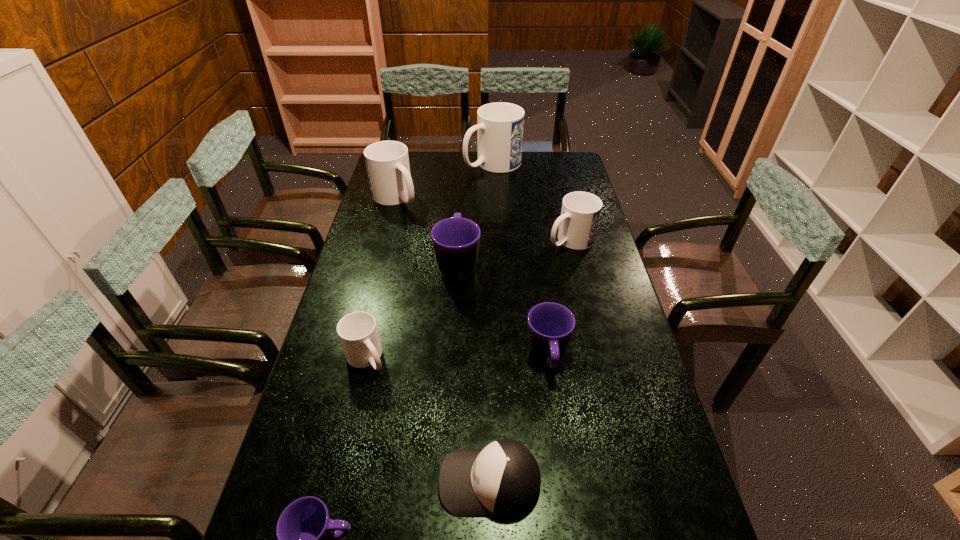
Where is `the smallest blue mug`? The width and height of the screenshot is (960, 540). the smallest blue mug is located at coordinates (357, 331).

Image resolution: width=960 pixels, height=540 pixels. I want to click on cap, so click(503, 480).

This screenshot has width=960, height=540. I want to click on blank space located on the right of the tallest object, so click(x=566, y=164).

Find the location of a particular element. vacant area located on the front of the second farthest object is located at coordinates (378, 264).

The image size is (960, 540). What are the coordinates of `free space located with the handle on the side of the farthest black mug` in the screenshot? It's located at (461, 213).

This screenshot has width=960, height=540. In order to click on free spot located with the handle on the side of the farthest black mug in this screenshot , I will do click(459, 236).

You are a GUI agent. You are given a task and a screenshot of the screen. Output one action in this format:
    pyautogui.click(x=<x>, y=<y>)
    Task: Click on the free region located 0.150m with the handle on the side of the farthest black mug
    The height and width of the screenshot is (540, 960).
    Given the screenshot: What is the action you would take?
    pyautogui.click(x=460, y=220)

Find the location of `free spot located on the left of the third farthest blue mug`. free spot located on the left of the third farthest blue mug is located at coordinates (498, 240).

You are a GUI agent. You are given a task and a screenshot of the screen. Output one action in this format:
    pyautogui.click(x=<x>, y=<y>)
    Task: Click on the vacant space situated with the handle on the side of the second biggest black mug
    This screenshot has height=540, width=960.
    Given the screenshot: What is the action you would take?
    pyautogui.click(x=565, y=487)

Locate an element on the screen. vacant space located on the back of the smallest blue mug is located at coordinates (379, 302).